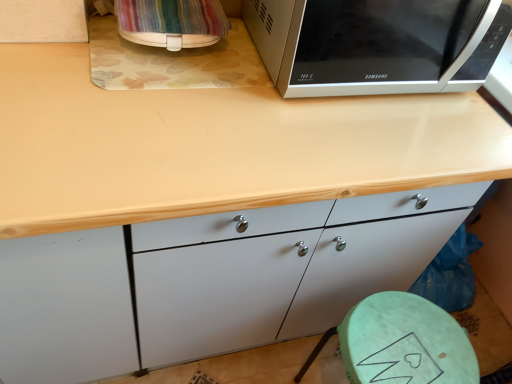
Question: Does green matte stool at lower right have a lesser height compared to sleek silver microwave at upper right?

Choices:
 (A) no
 (B) yes

Answer: (A)

Question: From a real-world perspective, is green matte stool at lower right on sleek silver microwave at upper right?

Choices:
 (A) no
 (B) yes

Answer: (A)

Question: From the image's perspective, would you say green matte stool at lower right is shown under sleek silver microwave at upper right?

Choices:
 (A) no
 (B) yes

Answer: (B)

Question: Can you confirm if green matte stool at lower right is bigger than sleek silver microwave at upper right?

Choices:
 (A) no
 (B) yes

Answer: (A)

Question: Is green matte stool at lower right located outside sleek silver microwave at upper right?

Choices:
 (A) no
 (B) yes

Answer: (B)

Question: Is green matte stool at lower right to the left of sleek silver microwave at upper right from the viewer's perspective?

Choices:
 (A) no
 (B) yes

Answer: (A)

Question: Is wooden at upper center behind sleek silver microwave at upper right?

Choices:
 (A) no
 (B) yes

Answer: (A)

Question: Is wooden at upper center smaller than sleek silver microwave at upper right?

Choices:
 (A) no
 (B) yes

Answer: (A)

Question: Is sleek silver microwave at upper right inside wooden at upper center?

Choices:
 (A) yes
 (B) no

Answer: (B)

Question: Is wooden at upper center not near sleek silver microwave at upper right?

Choices:
 (A) yes
 (B) no

Answer: (B)

Question: Can you confirm if wooden at upper center is thinner than sleek silver microwave at upper right?

Choices:
 (A) yes
 (B) no

Answer: (B)

Question: From the image's perspective, is wooden at upper center under sleek silver microwave at upper right?

Choices:
 (A) yes
 (B) no

Answer: (A)

Question: Is green matte stool at lower right at the right side of striped fabric bag at upper left?

Choices:
 (A) yes
 (B) no

Answer: (A)